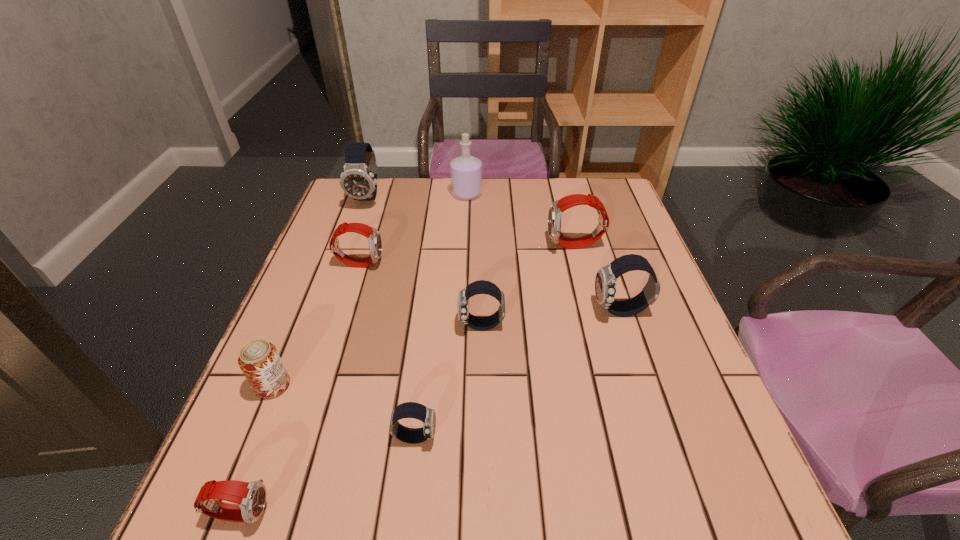
This screenshot has height=540, width=960. What are the coordinates of `vacant space located on the face of the biggest red watch` in the screenshot? It's located at (473, 246).

At what (x,y) coordinates should I click in order to perform the action: click on blank space located on the face of the second smallest dark watch. Please return your answer as a coordinate pair (x, y). This screenshot has width=960, height=540. Looking at the image, I should click on (329, 326).

In order to click on vacant point located 0.290m on the face of the second smallest dark watch in this screenshot , I will do `click(329, 326)`.

Where is `free location located on the face of the second smallest dark watch`? The image size is (960, 540). free location located on the face of the second smallest dark watch is located at coordinates (370, 326).

You are a GUI agent. You are given a task and a screenshot of the screen. Output one action in this format:
    pyautogui.click(x=<x>, y=<y>)
    Task: Click on the vacant area located 0.090m on the face of the second smallest red watch
    
    Given the screenshot: What is the action you would take?
    pyautogui.click(x=418, y=263)

The width and height of the screenshot is (960, 540). I want to click on vacant space positioned on the right of the third nearest object, so click(478, 386).

Where is `vacant space located 0.180m on the face of the eighth farthest object`? vacant space located 0.180m on the face of the eighth farthest object is located at coordinates (537, 436).

Identify the location of free location located 0.250m on the face of the nearest object. Image resolution: width=960 pixels, height=540 pixels. (428, 512).

Where is `perfume at the far edge`? This screenshot has height=540, width=960. perfume at the far edge is located at coordinates (466, 171).

Find the location of `watch at the far edge`. watch at the far edge is located at coordinates (358, 180).